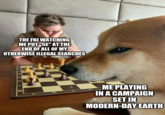
The width and height of the screenshot is (165, 115). I want to click on brown wooden table, so click(12, 106).